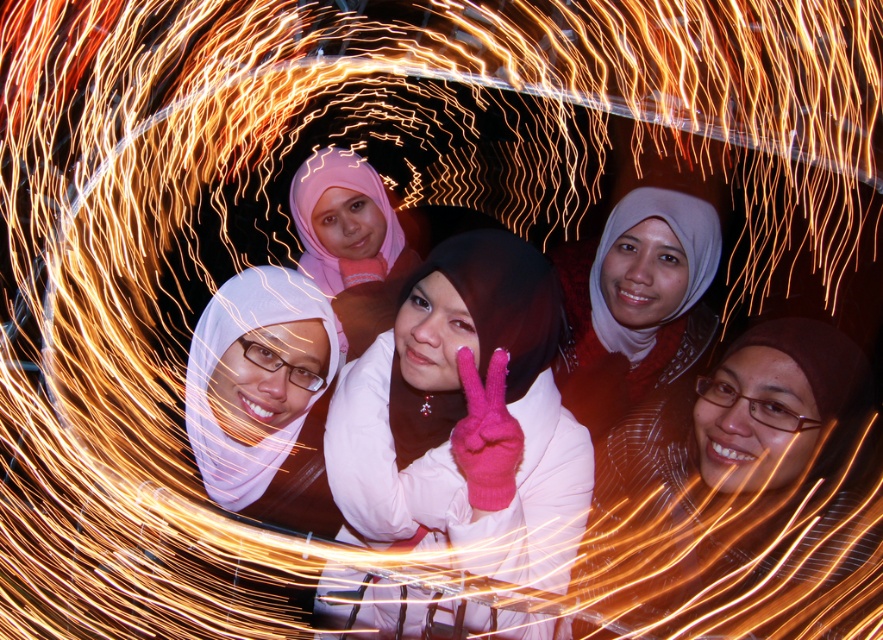
Which is more to the left, pink woolen gloves at center or pink fabric hijab at center?

From the viewer's perspective, pink woolen gloves at center appears more on the left side.

Does point (557, 308) come in front of point (730, 484)?

No, it is not.

The height and width of the screenshot is (640, 883). Find the location of `pink woolen gloves at center`. pink woolen gloves at center is located at coordinates (465, 420).

Is point (821, 369) closer to viewer compared to point (684, 246)?

That is True.

Can you confirm if pink fabric hijab at center is thinner than matte white hijab at center?

No.

Where is `pink fabric hijab at center`? The width and height of the screenshot is (883, 640). pink fabric hijab at center is located at coordinates (738, 492).

Which is behind, point (480, 269) or point (653, 240)?

Point (653, 240)

Locate an element on the screen. The image size is (883, 640). pink woolen gloves at center is located at coordinates (465, 420).